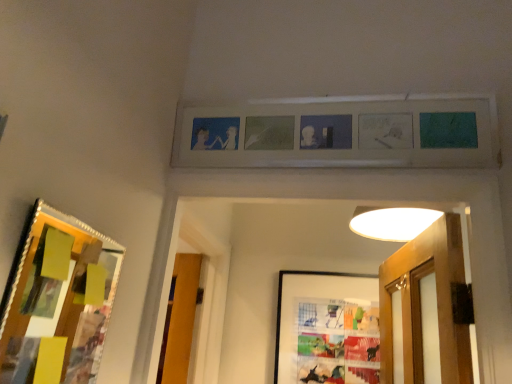
Question: Considering the positions of point (295, 148) and point (374, 294), is point (295, 148) closer or farther from the camera than point (374, 294)?

Choices:
 (A) farther
 (B) closer

Answer: (B)

Question: Is matte wooden picture frame at upper center, which ranks as the 2th picture frame in back-to-front order, inside or outside of matte plastic picture frame at center, the 1th picture frame when ordered from back to front?

Choices:
 (A) inside
 (B) outside

Answer: (B)

Question: Based on their relative distances, which object is nearer to the matte wooden picture frame at upper center, the second picture frame when ordered from front to back?

Choices:
 (A) wooden-framed collage at left, which is the second picture frame in bottom-to-top order
 (B) matte plastic picture frame at center, the 3th picture frame positioned from the top

Answer: (A)

Question: Considering the real-world distances, which object is closest to the wooden-framed collage at left, the 3th picture frame when ordered from back to front?

Choices:
 (A) matte wooden picture frame at upper center, the second picture frame when ordered from front to back
 (B) matte plastic picture frame at center, which is the third picture frame from front to back

Answer: (A)